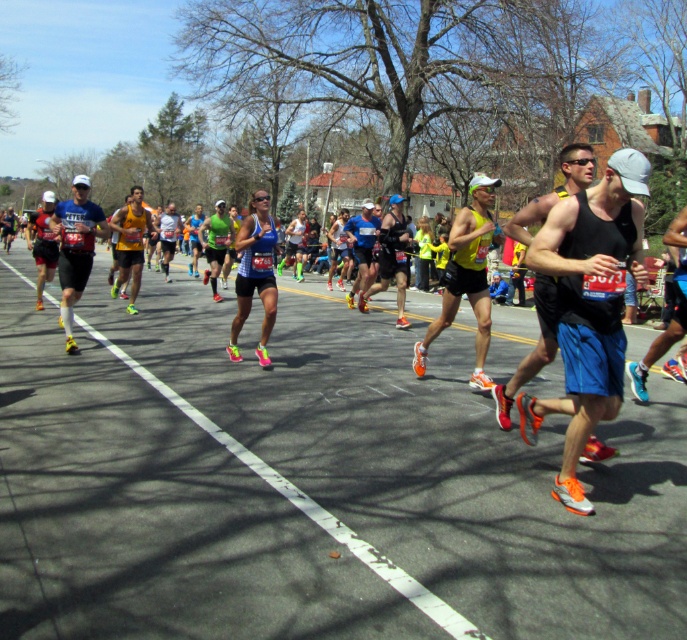
Can you confirm if black tank top at center is thinner than matte black shorts at left?

Yes.

This screenshot has width=687, height=640. Find the location of `black tank top at center`. black tank top at center is located at coordinates (532, 349).

At what (x,y) coordinates should I click in order to perform the action: click on black tank top at center. Please return your answer as a coordinate pair (x, y). Looking at the image, I should click on (532, 349).

Can you confirm if matte black tank top at center is taller than matte blue tank top at center?

Correct, matte black tank top at center is much taller as matte blue tank top at center.

Between matte black tank top at center and matte blue tank top at center, which one appears on the right side from the viewer's perspective?

matte black tank top at center

What do you see at coordinates (587, 307) in the screenshot? This screenshot has width=687, height=640. I see `matte black tank top at center` at bounding box center [587, 307].

Identify the location of matte black tank top at center. The image size is (687, 640). (587, 307).

I want to click on matte black tank top at center, so click(x=587, y=307).

This screenshot has width=687, height=640. What do you see at coordinates (587, 307) in the screenshot?
I see `matte black tank top at center` at bounding box center [587, 307].

Does point (619, 218) come in front of point (540, 216)?

Yes, point (619, 218) is in front of point (540, 216).

Locate an element on the screen. matte black tank top at center is located at coordinates (587, 307).